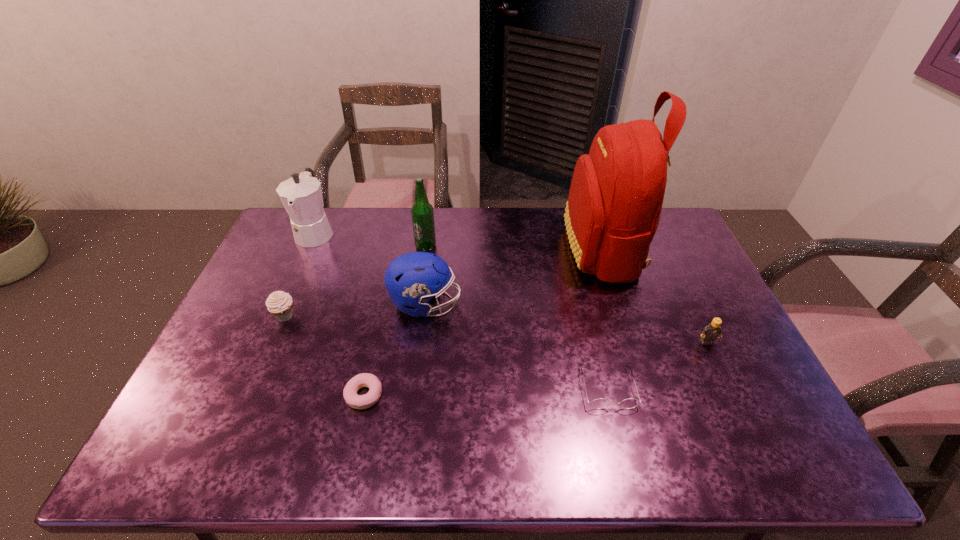
Locate an element on the screen. free spot between the spectacles and the coffeepot is located at coordinates point(462,310).

Identify the location of blank region between the beer bottle and the coffeepot. The height and width of the screenshot is (540, 960). (371, 239).

Image resolution: width=960 pixels, height=540 pixels. Identify the location of free space between the Lego and the muffin. (496, 329).

This screenshot has height=540, width=960. What are the coordinates of `empty space between the muffin and the coffeepot` in the screenshot? It's located at (300, 274).

You are a GUI agent. You are given a task and a screenshot of the screen. Output one action in this format:
    pyautogui.click(x=<x>, y=<y>)
    Task: Click on the free point between the football helmet and the Lego
    The image size is (960, 540).
    Given the screenshot: What is the action you would take?
    (566, 323)

Locate an element on the screen. This screenshot has height=540, width=960. blank region between the coffeepot and the shortest object is located at coordinates (340, 314).

Where is `vacant region between the coffeepot and the muffin`? This screenshot has height=540, width=960. vacant region between the coffeepot and the muffin is located at coordinates (300, 274).

The height and width of the screenshot is (540, 960). Find the location of `vacant area that lies between the doughnut and the fourth tallest object`. vacant area that lies between the doughnut and the fourth tallest object is located at coordinates (395, 349).

This screenshot has width=960, height=540. I want to click on vacant region between the coffeepot and the football helmet, so click(371, 268).

You are a GUI agent. You are given a task and a screenshot of the screen. Output one action in this format:
    pyautogui.click(x=<x>, y=<y>)
    Task: Click on the vacant space that's between the coffeepot and the spectacles
    The width and height of the screenshot is (960, 540).
    Given the screenshot: What is the action you would take?
    pyautogui.click(x=462, y=310)